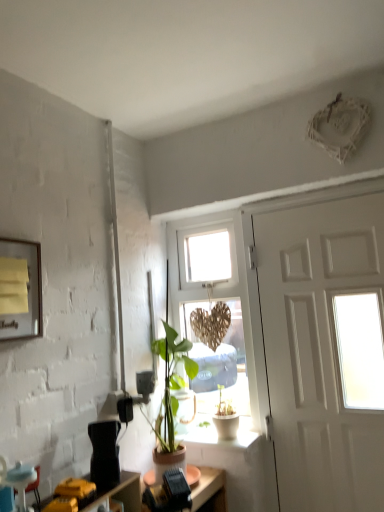
The image size is (384, 512). What are the coordinates of `vacant region above white matte door at right (from a real-world perspective)` in the screenshot? It's located at (317, 203).